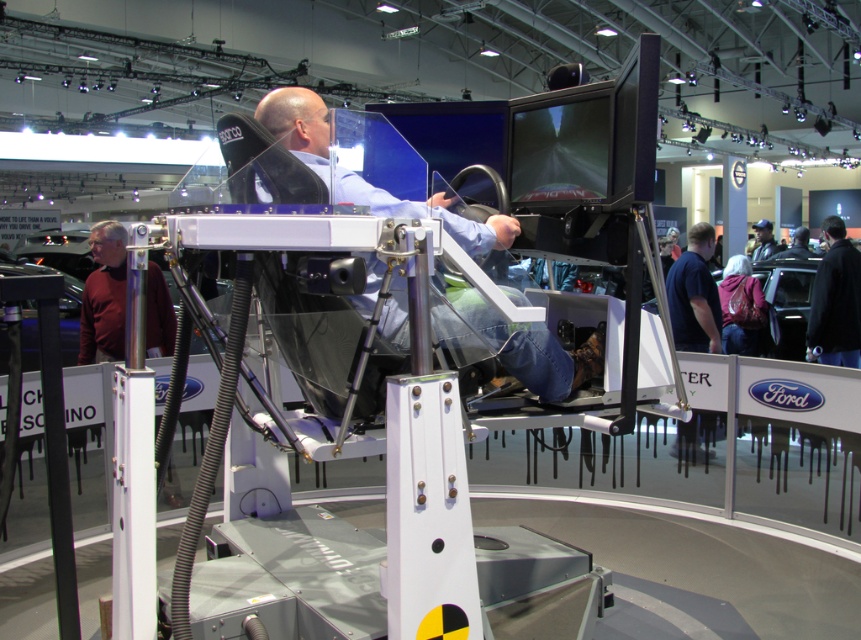
You are at the exhibition and want to take a photo of the matte black simulator at center and the black leather jacket at lower right together in the frame. Which object should you position closer to the camera to ensure both are visible?

To include both the matte black simulator at center and the black leather jacket at lower right in the frame, position the black leather jacket at lower right closer to the camera since the matte black simulator at center is further away on the left side of the jacket.

You are at an automotive exhibition and see two jackets displayed near the driving simulator. The black leather jacket at lower right and the dark blue leather jacket at upper right. Which jacket is taller?

The black leather jacket at lower right is much taller than the dark blue leather jacket at upper right.

You are a technician at the exhibition and need to reach the dark blue leather jacket at upper right from the matte black simulator at center. Given that the average walking speed is 3 feet per second, how many seconds will it take you to reach it?

The matte black simulator at center is 33.72 feet away from dark blue leather jacket at upper right. At an average walking speed of 3 feet per second, it would take approximately 11.24 seconds to reach the dark blue leather jacket at upper right.